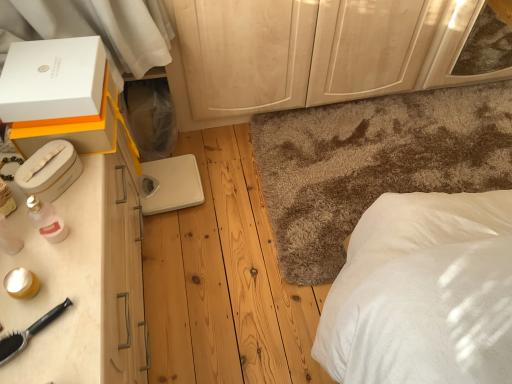
Image resolution: width=512 pixels, height=384 pixels. In order to click on vacant space in front of white plastic box at left, marked as the 1th box in a bottom-to-top arrangement in this screenshot , I will do `click(50, 236)`.